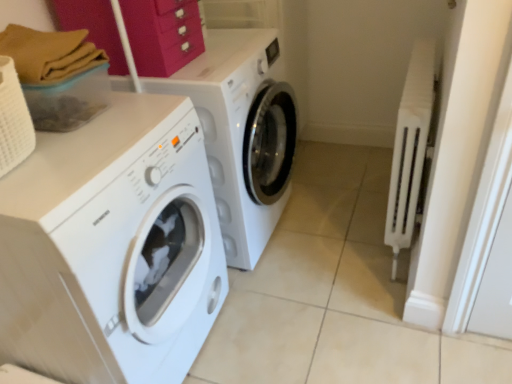
Question: Is white glossy washing machine at left, which is counted as the 1th washing machine, starting from the front, located outside white plastic radiator at right?

Choices:
 (A) yes
 (B) no

Answer: (A)

Question: Can you confirm if white glossy washing machine at left, which is counted as the 1th washing machine, starting from the front, is taller than white plastic radiator at right?

Choices:
 (A) no
 (B) yes

Answer: (B)

Question: Is white glossy washing machine at left, which is counted as the 1th washing machine, starting from the front, shorter than white plastic radiator at right?

Choices:
 (A) yes
 (B) no

Answer: (B)

Question: From a real-world perspective, is white glossy washing machine at left, which is counted as the 1th washing machine, starting from the front, below white plastic radiator at right?

Choices:
 (A) no
 (B) yes

Answer: (A)

Question: Can you confirm if white glossy washing machine at left, which is counted as the 1th washing machine, starting from the front, is wider than white plastic radiator at right?

Choices:
 (A) no
 (B) yes

Answer: (B)

Question: Is white glossy washing machine at left, the 2th washing machine positioned from the back, further to the viewer compared to white plastic radiator at right?

Choices:
 (A) yes
 (B) no

Answer: (B)

Question: From a real-world perspective, is white plastic radiator at right positioned under matte pink drawer at upper center based on gravity?

Choices:
 (A) no
 (B) yes

Answer: (B)

Question: Is white plastic radiator at right to the right of matte pink drawer at upper center from the viewer's perspective?

Choices:
 (A) no
 (B) yes

Answer: (B)

Question: Is white plastic radiator at right bigger than matte pink drawer at upper center?

Choices:
 (A) yes
 (B) no

Answer: (A)

Question: Is white plastic radiator at right to the left of matte pink drawer at upper center from the viewer's perspective?

Choices:
 (A) yes
 (B) no

Answer: (B)

Question: Is white plastic radiator at right with matte pink drawer at upper center?

Choices:
 (A) no
 (B) yes

Answer: (A)

Question: Is white plastic radiator at right not within matte pink drawer at upper center?

Choices:
 (A) yes
 (B) no

Answer: (A)

Question: Is white glossy washing machine at center, positioned as the second washing machine in front-to-back order, wider than matte pink drawer at upper center?

Choices:
 (A) no
 (B) yes

Answer: (B)